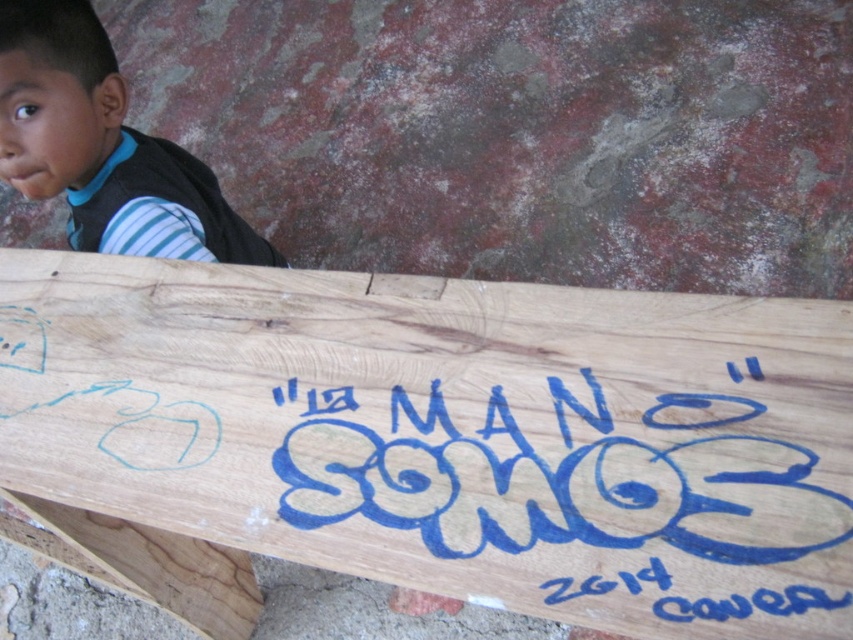
You are an artist planning to paint a mural on a wall. You have a canvas that is the same size as the natural wood sign at lower center. Can you fit the striped fabric shirt at upper left design onto this canvas?

The natural wood sign at lower center is larger than the striped fabric shirt at upper left, so yes, the canvas can accommodate the striped fabric shirt at upper left design.

You are a photographer standing in front of the wooden plank with graffiti. You notice two points marked on the plank at coordinates point (756, 499) and point (625, 627). Which point is closer to your camera?

Point (756, 499) is further to the camera than point (625, 627), so the closer point to your camera is point (625, 627).

You are standing in front of a wooden plank with graffiti. The blue painted graffiti at center has coordinates given. If you move 0.1 units to the right from the graffiti, where would you be relative to the young boy partially visible to the left?

The blue painted graffiti at center is located at point (575, 500). Moving 0.1 units to the right from this point would place you at approximately 0.884 on the x coordinate. Since the young boy is on the left side of the image, moving right from the graffiti would take you away from the boy towards the opposite side of the image.